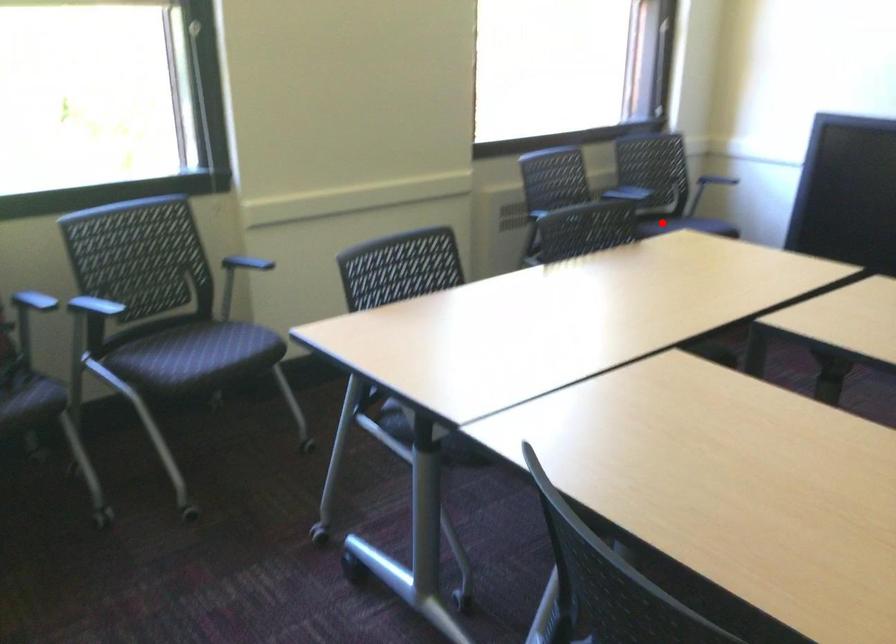
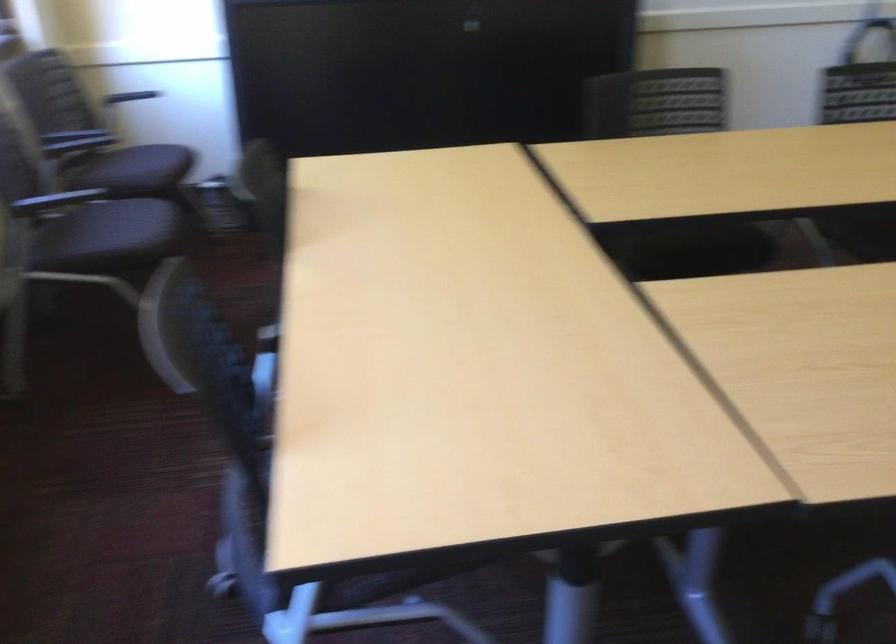
Question: A red point is marked in image1. In image2, is the corresponding 3D point closer to the camera or farther? Reply with the corresponding letter.

Choices:
 (A) The corresponding 3D point is closer.
 (B) The corresponding 3D point is farther.

Answer: (A)